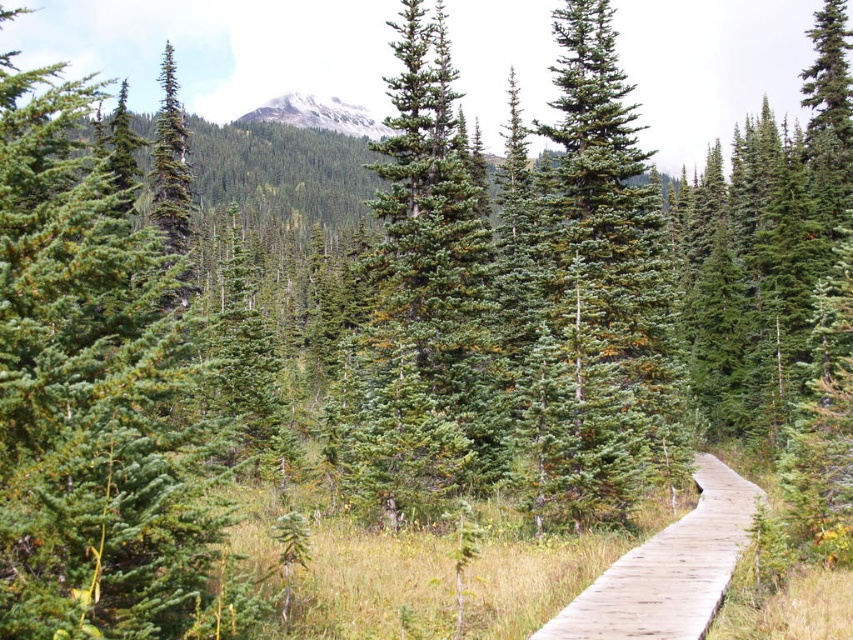
Is green needle-like at center taller than snowy granite mountain at upper center?

No, green needle-like at center is not taller than snowy granite mountain at upper center.

Does green needle-like at center have a larger size compared to snowy granite mountain at upper center?

Incorrect, green needle-like at center is not larger than snowy granite mountain at upper center.

Where is `green needle-like at center`? The height and width of the screenshot is (640, 853). green needle-like at center is located at coordinates (614, 227).

Between green needle-like at left and snowy granite mountain at upper center, which one is positioned higher?

Positioned higher is snowy granite mountain at upper center.

Does point (30, 529) come closer to viewer compared to point (321, 99)?

Yes, it is in front of point (321, 99).

Does point (33, 602) lie in front of point (318, 116)?

Yes, it is in front of point (318, 116).

Where is `green needle-like at left`? green needle-like at left is located at coordinates (90, 392).

Does wooden boardwalk at center-right have a greater width compared to snowy granite mountain at upper center?

In fact, wooden boardwalk at center-right might be narrower than snowy granite mountain at upper center.

Who is positioned more to the left, wooden boardwalk at center-right or snowy granite mountain at upper center?

snowy granite mountain at upper center

Does point (722, 474) come behind point (264, 104)?

No, it is not.

Image resolution: width=853 pixels, height=640 pixels. I want to click on wooden boardwalk at center-right, so click(x=668, y=570).